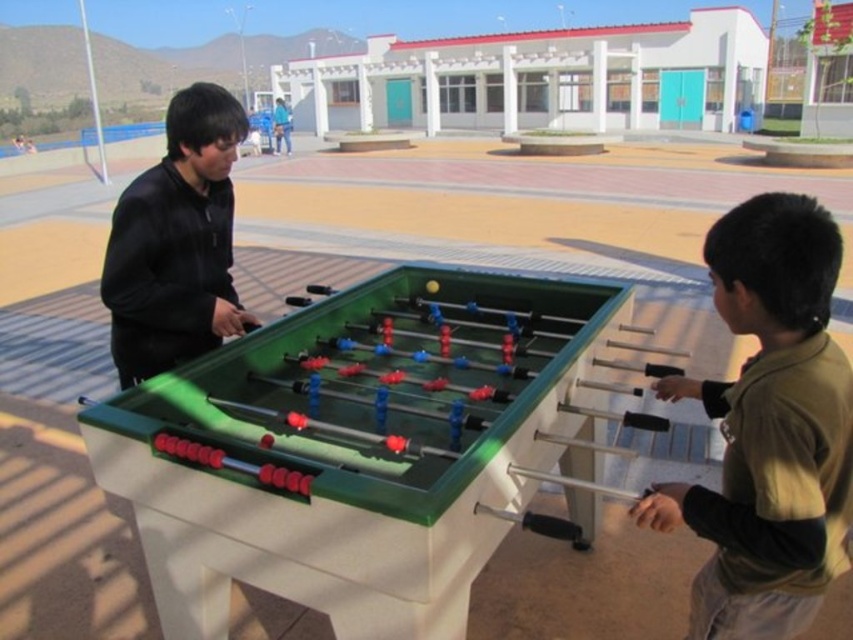
Which is more to the left, light brown fleece jacket at lower right or black matte jacket at center?

From the viewer's perspective, black matte jacket at center appears more on the left side.

Can you confirm if light brown fleece jacket at lower right is positioned below black matte jacket at center?

Yes, light brown fleece jacket at lower right is below black matte jacket at center.

Which is behind, point (743, 465) or point (148, 360)?

Point (148, 360)

The width and height of the screenshot is (853, 640). I want to click on light brown fleece jacket at lower right, so click(769, 428).